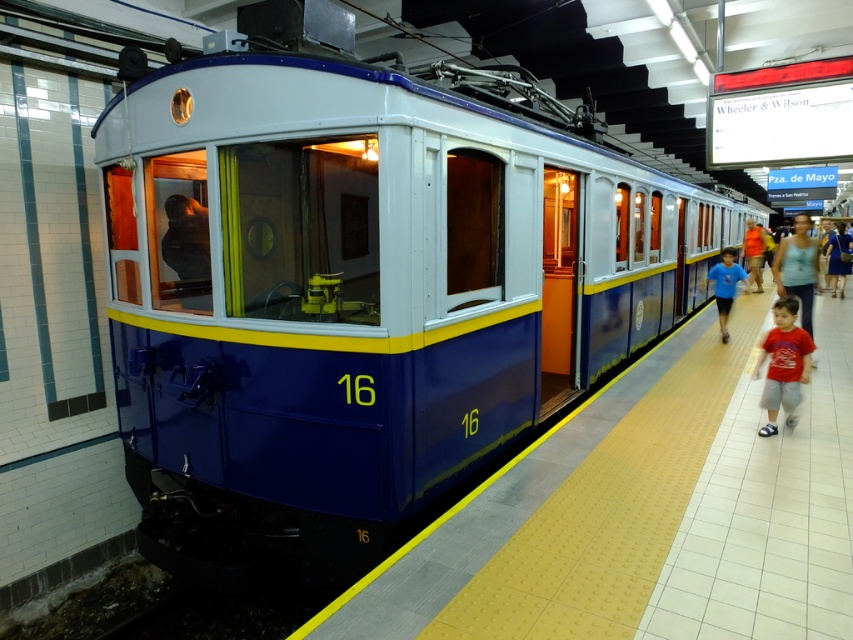
You are a passenger waiting at the station platform. You see the blue polished metal train at center and the blue dress at right. Which object is closer to you as you stand on the platform?

The blue polished metal train at center is closer to you because it is in front of the blue dress at right.

You are a passenger who wants to board the tram. You are standing on the blue glossy platform at center and see the blue dress at right. Which object is wider?

The blue glossy platform at center is wider than the blue dress at right.